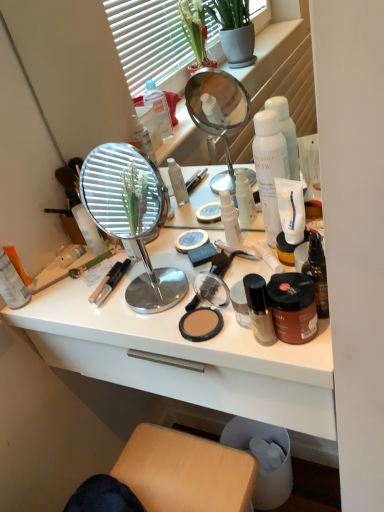
At what (x,y) coordinates should I click in order to perform the action: click on empty space that is in between matte black compact at center and matte black brush at lower left. Please return your answer as a coordinate pair (x, y). The width and height of the screenshot is (384, 512). Looking at the image, I should click on (108, 297).